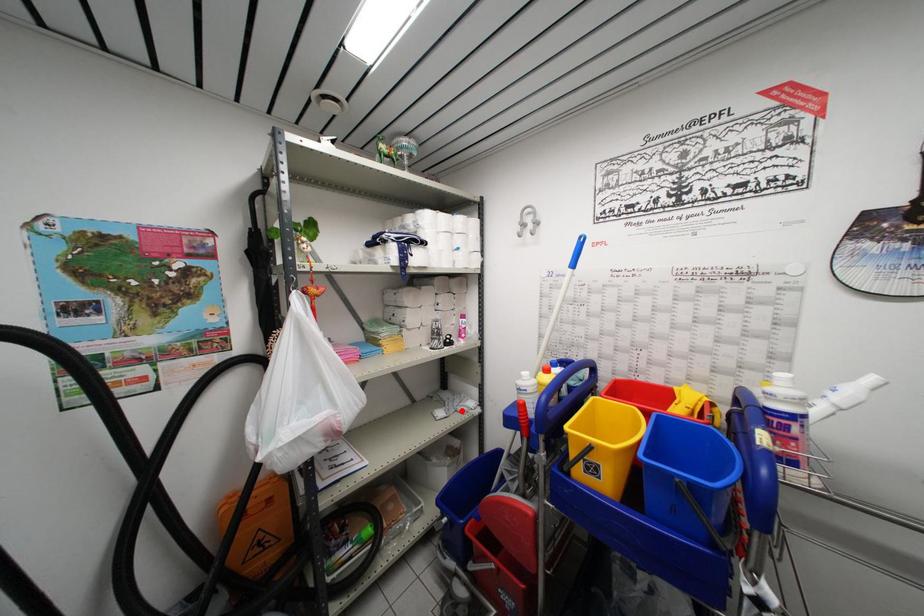
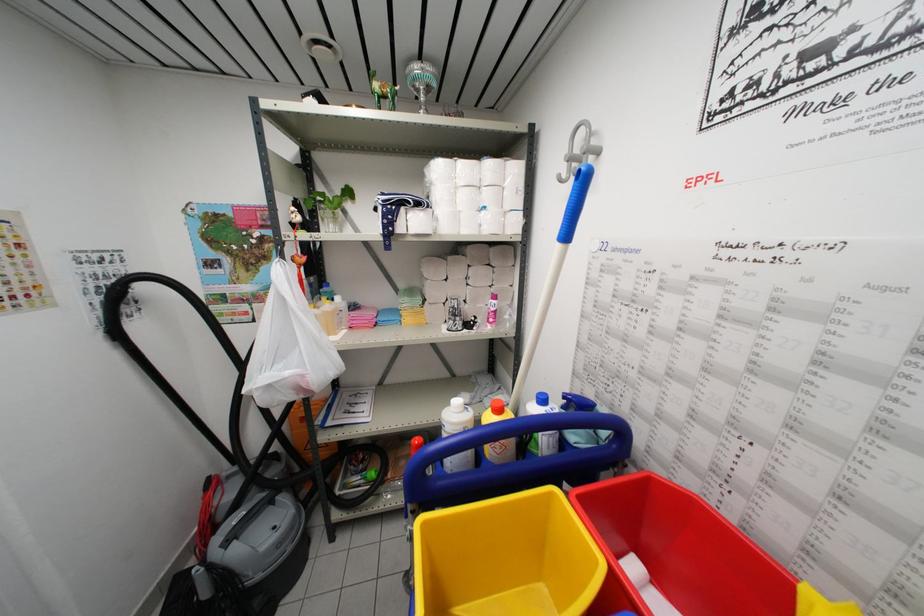
Find the pixel in the second image that matches the highlighted location in the first image.

(490, 402)